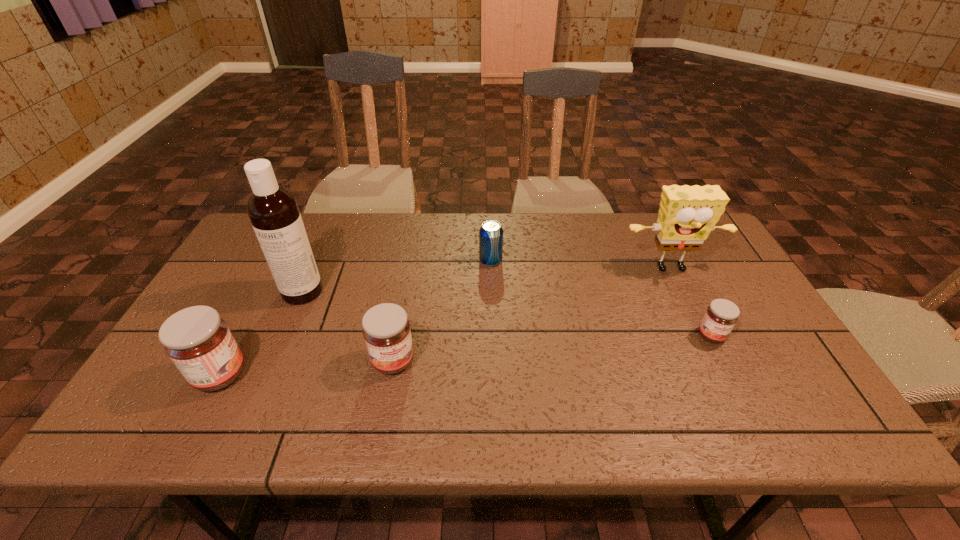
Image resolution: width=960 pixels, height=540 pixels. What are the coordinates of `unoccupied area between the shortest jam and the second tallest object` in the screenshot? It's located at (691, 302).

Find the location of a particular element. This screenshot has width=960, height=540. free spot between the second tallest object and the fourth object from right to left is located at coordinates (533, 315).

What are the coordinates of `unoccupied area between the beer can and the leftmost jam` in the screenshot? It's located at (355, 318).

This screenshot has height=540, width=960. In order to click on free space that is in between the fourth object from left to right and the sponge in this screenshot , I will do `click(581, 265)`.

Locate an element on the screen. This screenshot has width=960, height=540. vacant space that is in between the beer can and the leftmost jam is located at coordinates (355, 318).

You are a GUI agent. You are given a task and a screenshot of the screen. Output one action in this format:
    pyautogui.click(x=<x>, y=<y>)
    Task: Click on the closest object to the second shortest jam
    The width and height of the screenshot is (960, 540).
    Given the screenshot: What is the action you would take?
    pyautogui.click(x=273, y=211)

You are a GUI agent. You are given a task and a screenshot of the screen. Output one action in this format:
    pyautogui.click(x=<x>, y=<y>)
    Task: Click on the object that is the closest to the leftmost jam
    The image size is (960, 540).
    Given the screenshot: What is the action you would take?
    pyautogui.click(x=273, y=211)

Identify which jam is located as the third nearest to the second tallest object. Please provide its 2D coordinates. Your answer should be formatted as a tuple, i.e. [(x, y)], where the tuple contains the x and y coordinates of a point satisfying the conditions above.

[(198, 341)]

Select which jam is the third closest to the tallest object. Please provide its 2D coordinates. Your answer should be formatted as a tuple, i.e. [(x, y)], where the tuple contains the x and y coordinates of a point satisfying the conditions above.

[(721, 315)]

Where is `free space that satisfies the following two spatial constraints: 1. on the front-facing side of the shortest object; 2. on the left side of the sponge`? Image resolution: width=960 pixels, height=540 pixels. free space that satisfies the following two spatial constraints: 1. on the front-facing side of the shortest object; 2. on the left side of the sponge is located at coordinates (704, 335).